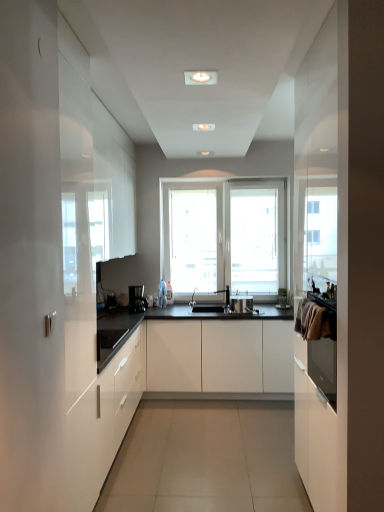
The image size is (384, 512). I want to click on vacant area to the right of black plastic coffee machine at center, so click(154, 312).